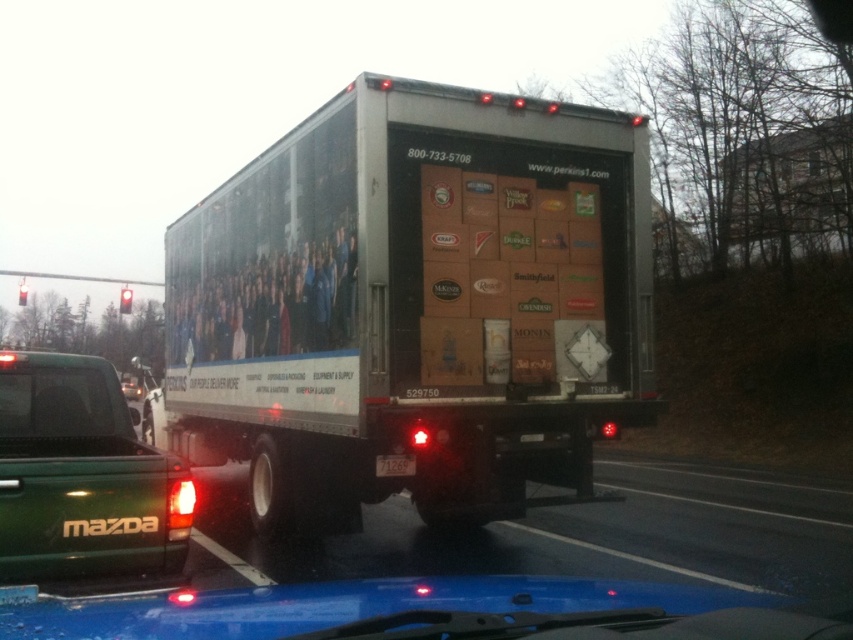
Question: Does silver metallic trailer truck at center appear on the left side of green matte truck at lower left?

Choices:
 (A) yes
 (B) no

Answer: (B)

Question: In this image, where is green matte truck at lower left located relative to transparent glass windshield at lower left?

Choices:
 (A) right
 (B) left

Answer: (A)

Question: Which object is the farthest from the green matte truck at lower left?

Choices:
 (A) silver metallic trailer truck at center
 (B) transparent glass windshield at lower left

Answer: (A)

Question: Observing the image, what is the correct spatial positioning of silver metallic trailer truck at center in reference to green matte truck at lower left?

Choices:
 (A) below
 (B) above

Answer: (B)

Question: Among these objects, which one is nearest to the camera?

Choices:
 (A) green matte truck at lower left
 (B) transparent glass windshield at lower left

Answer: (A)

Question: Which object appears farthest from the camera in this image?

Choices:
 (A) black plastic license plate at center
 (B) silver metallic trailer truck at center

Answer: (A)